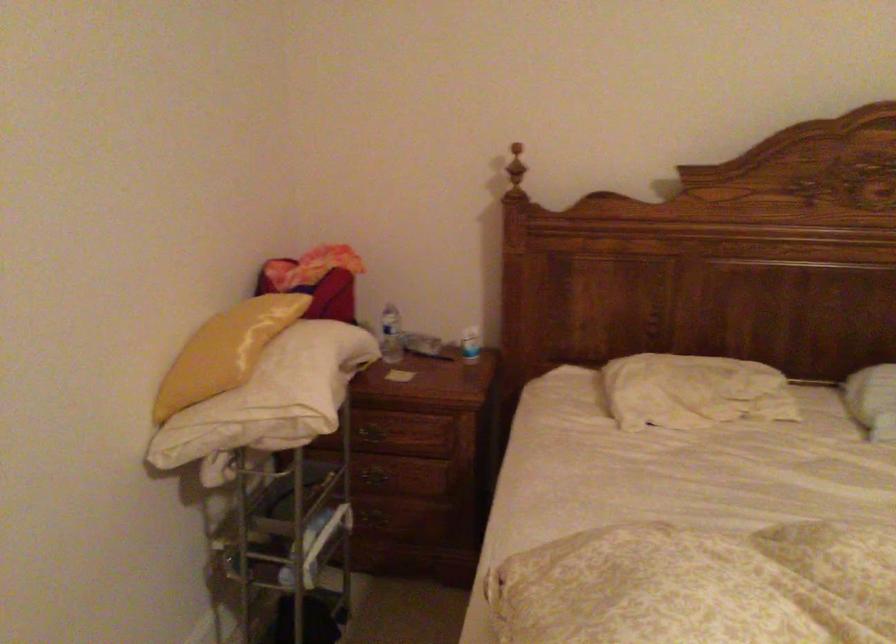
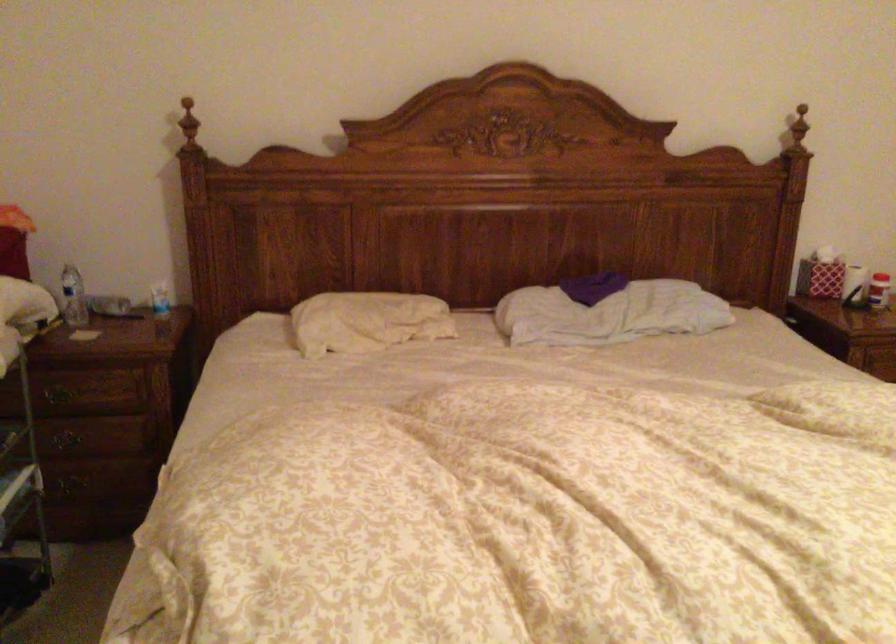
Question: The camera is either moving clockwise (left) or counter-clockwise (right) around the object. The first image is from the beginning of the video and the second image is from the end. Is the camera moving left or right when shooting the video?

Choices:
 (A) Left
 (B) Right

Answer: (A)